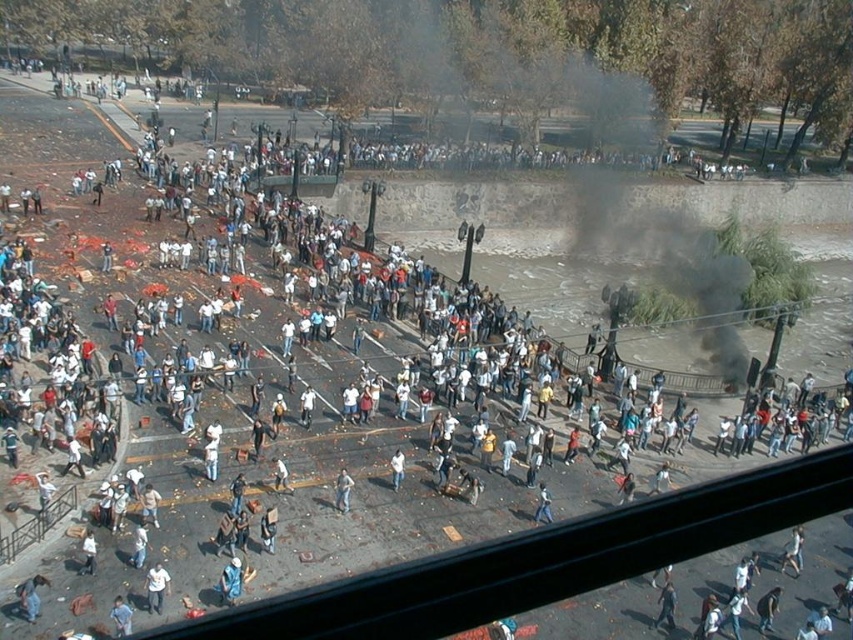
Is blue denim jeans at lower left positioned at the back of white matte person at lower left?

No, it is not.

Is point (126, 621) positioned after point (90, 536)?

No.

Does point (117, 598) come farther from viewer compared to point (93, 540)?

No, it is not.

This screenshot has height=640, width=853. I want to click on blue denim jeans at lower left, so click(x=120, y=616).

Can you confirm if white cotton shirt at lower center is taller than blue jeans at lower center?

Correct, white cotton shirt at lower center is much taller as blue jeans at lower center.

Is point (152, 579) farther from camera compared to point (543, 504)?

No, it is in front of (543, 504).

The width and height of the screenshot is (853, 640). Find the location of `white cotton shirt at lower center`. white cotton shirt at lower center is located at coordinates (155, 588).

Measure the distance between point (x=163, y=586) and camera.

Point (x=163, y=586) and camera are 37.08 meters apart from each other.

Is white cotton shirt at lower center below blue denim jeans at lower left?

Incorrect, white cotton shirt at lower center is not positioned below blue denim jeans at lower left.

Does point (157, 572) lie in front of point (122, 602)?

No, it is not.

This screenshot has height=640, width=853. In order to click on white cotton shirt at lower center in this screenshot , I will do `click(155, 588)`.